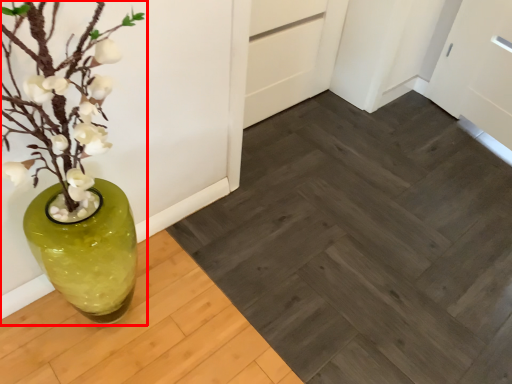
Question: From the image's perspective, considering the relative positions of houseplant (annotated by the red box) and plank in the image provided, where is houseplant (annotated by the red box) located with respect to the staircase?

Choices:
 (A) above
 (B) below

Answer: (A)